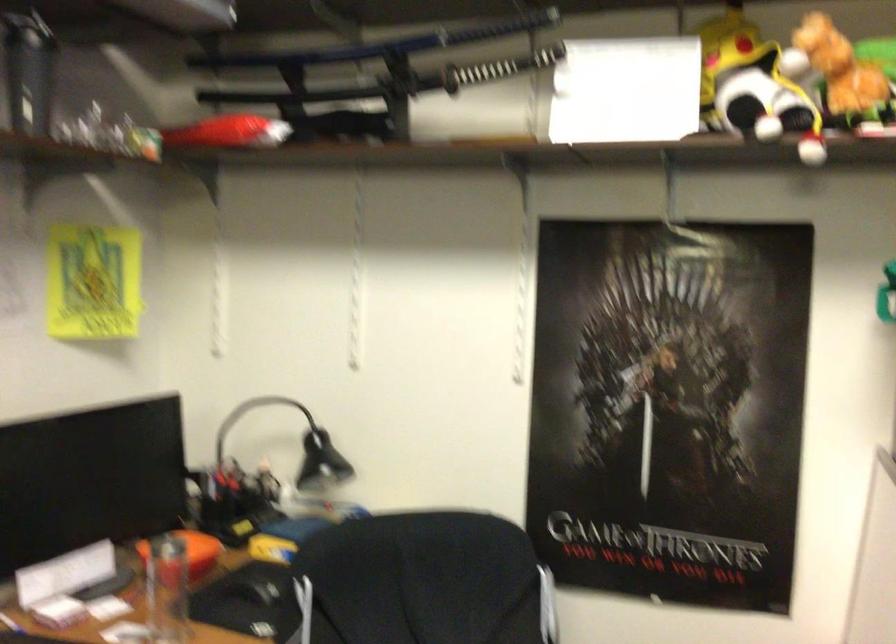
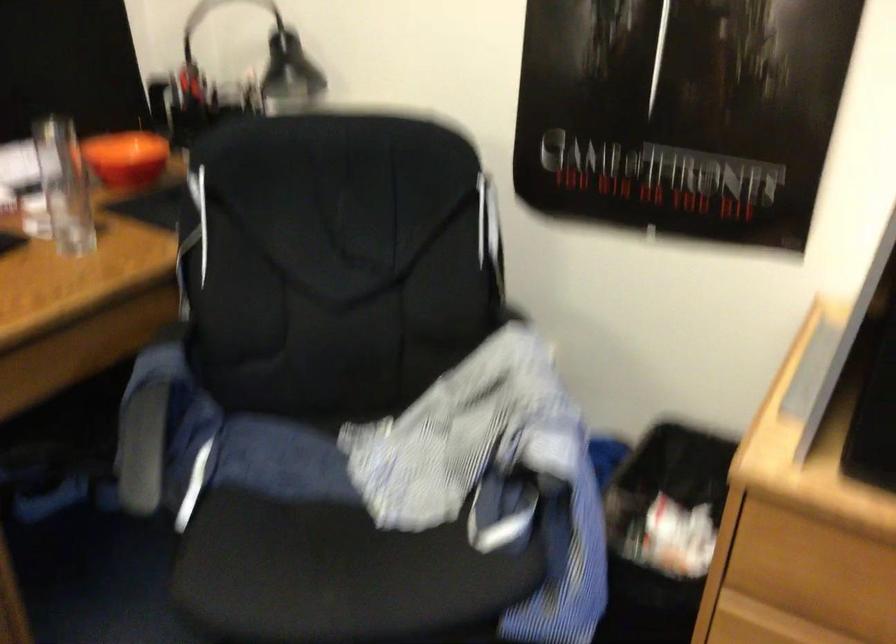
The point at (247, 467) is marked in the first image. Where is the corresponding point in the second image?

(233, 82)